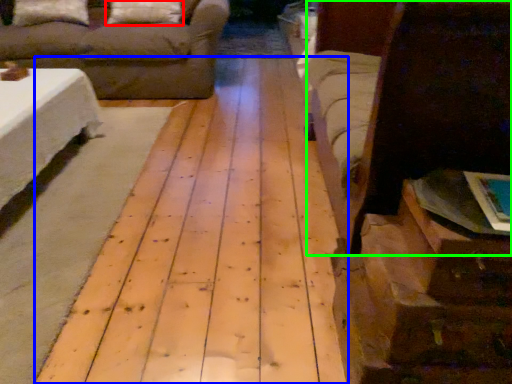
Question: Which is farther away from pillow (highlighted by a red box)? plywood (highlighted by a blue box) or bed (highlighted by a green box)?

Choices:
 (A) plywood
 (B) bed

Answer: (B)